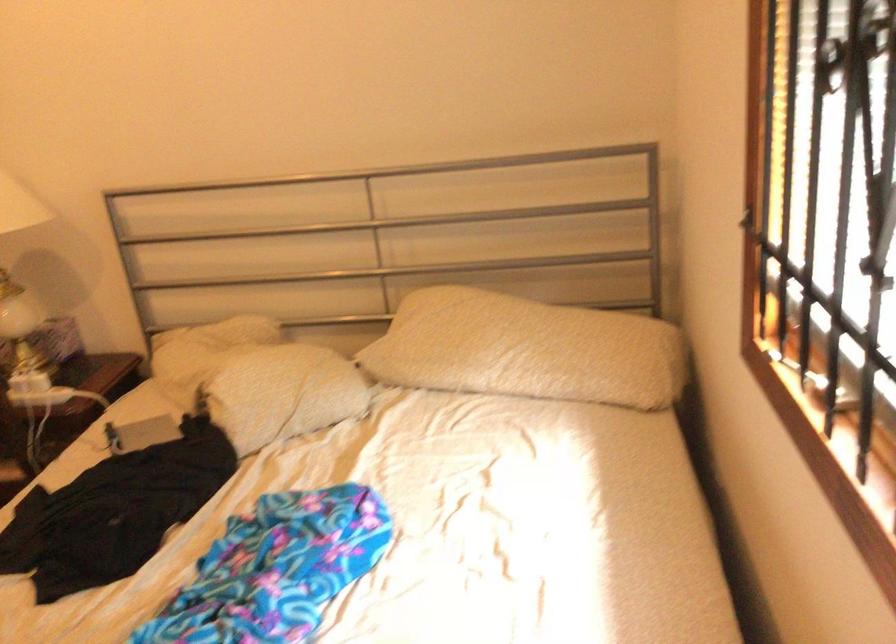
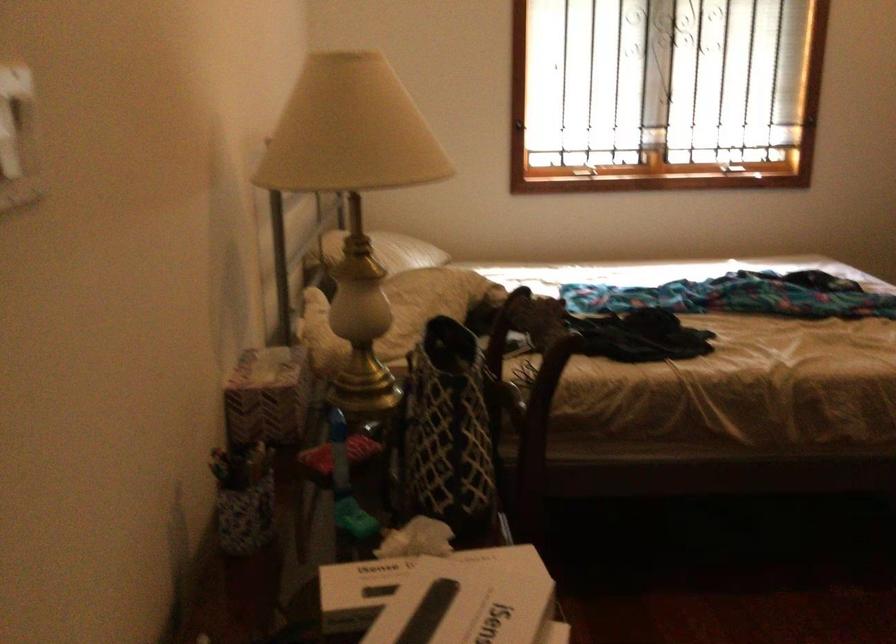
The point at (722, 227) is marked in the first image. Where is the corresponding point in the second image?

(520, 124)